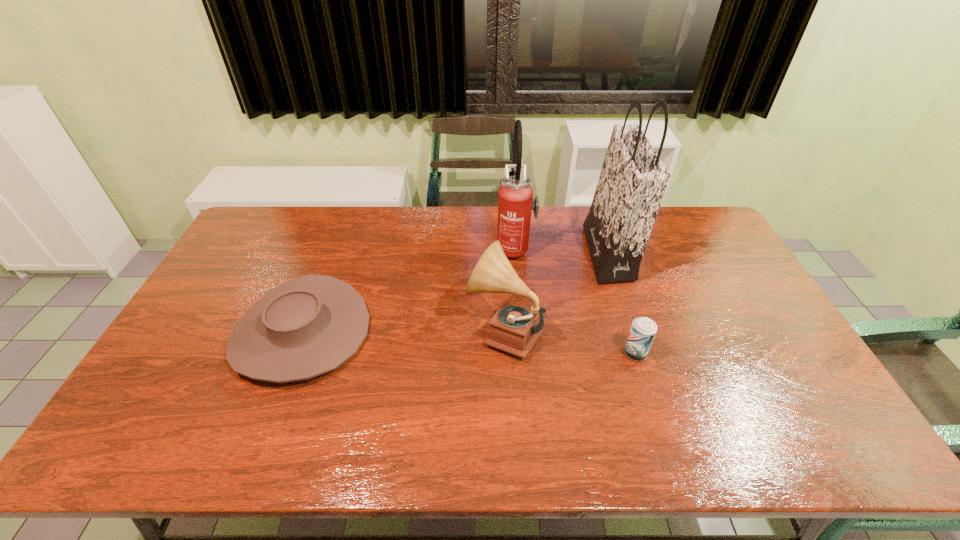
Locate an element on the screen. free space that satisfies the following two spatial constraints: 1. at the nozzle of the fourth shortest object; 2. on the back side of the beer can is located at coordinates (524, 353).